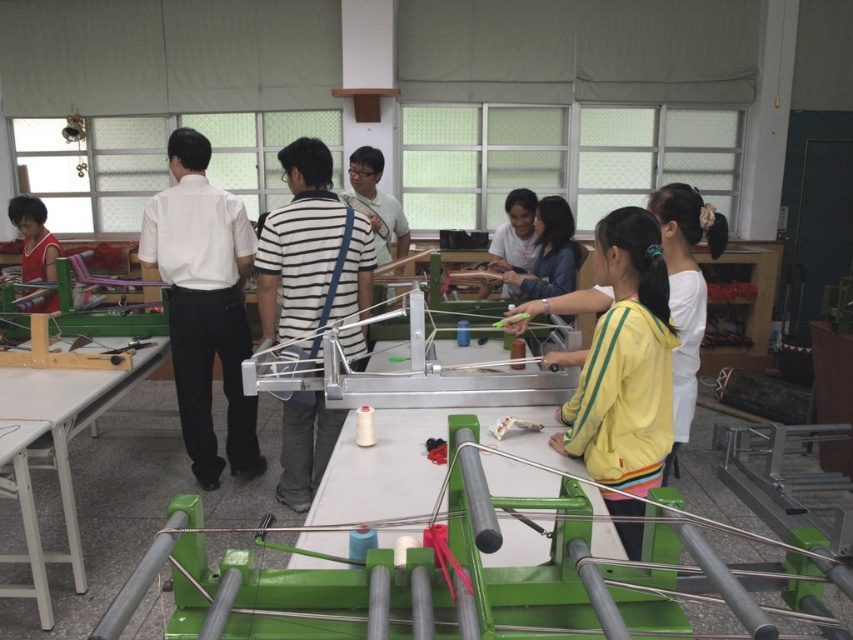
Question: Can you confirm if white striped shirt at center is thinner than matte red shirt at left?

Choices:
 (A) no
 (B) yes

Answer: (B)

Question: Which object is the closest to the white striped shirt at center?

Choices:
 (A) matte red shirt at left
 (B) white shirt at center

Answer: (B)

Question: Which object is positioned farthest from the matte red shirt at left?

Choices:
 (A) white shirt at center
 (B) white striped shirt at center

Answer: (B)

Question: Is white striped shirt at center below matte red shirt at left?

Choices:
 (A) no
 (B) yes

Answer: (B)

Question: Can you confirm if white striped shirt at center is positioned above matte red shirt at left?

Choices:
 (A) no
 (B) yes

Answer: (A)

Question: Which of the following is the closest to the observer?

Choices:
 (A) (183, 380)
 (B) (44, 262)
 (C) (338, 272)

Answer: (C)